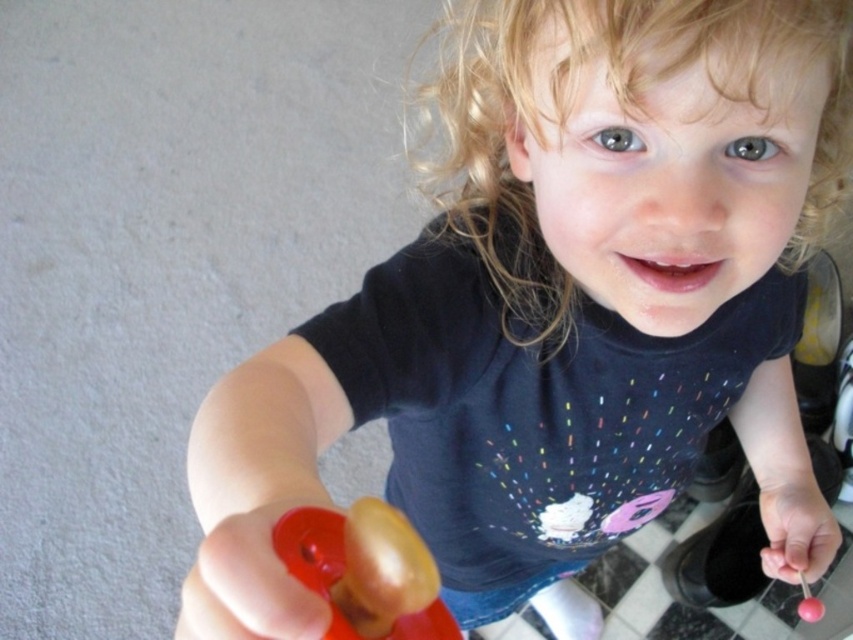
Which is more to the right, rubberized plastic toy at lower center or pink rubber lollipop at lower right?

From the viewer's perspective, pink rubber lollipop at lower right appears more on the right side.

What are the coordinates of `rubberized plastic toy at lower center` in the screenshot? It's located at (364, 572).

Looking at this image, which is above, rubberized plastic toy at lower left or pink rubber lollipop at lower right?

rubberized plastic toy at lower left is higher up.

Looking at this image, measure the distance between point (210,628) and camera.

9.22 inches

Is point (326, 624) less distant than point (808, 556)?

Yes, point (326, 624) is closer to viewer.

I want to click on rubberized plastic toy at lower left, so click(x=248, y=580).

Can you confirm if rubberized plastic toy at lower center is smaller than rubberized plastic toy at lower left?

Incorrect, rubberized plastic toy at lower center is not smaller in size than rubberized plastic toy at lower left.

Does point (291, 548) lie behind point (254, 564)?

Yes, point (291, 548) is farther from viewer.

The image size is (853, 640). What are the coordinates of `rubberized plastic toy at lower center` in the screenshot? It's located at (364, 572).